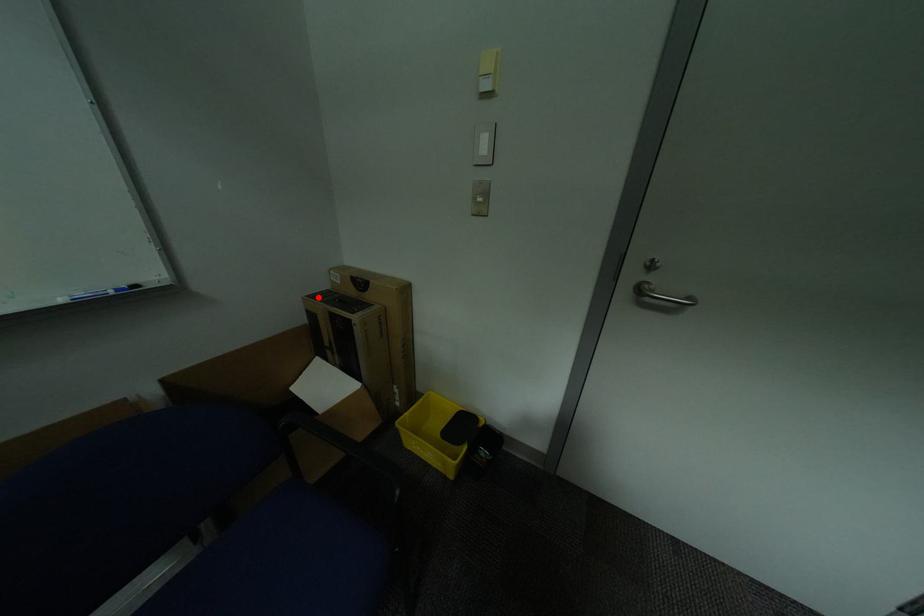
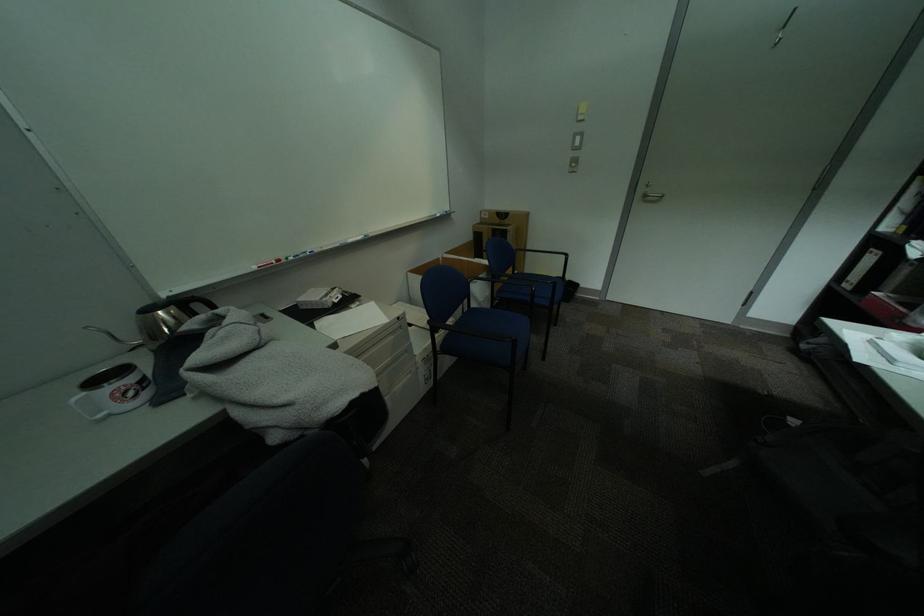
Where in the second image is the point corresponding to the highlighted location from the first image?

(487, 225)